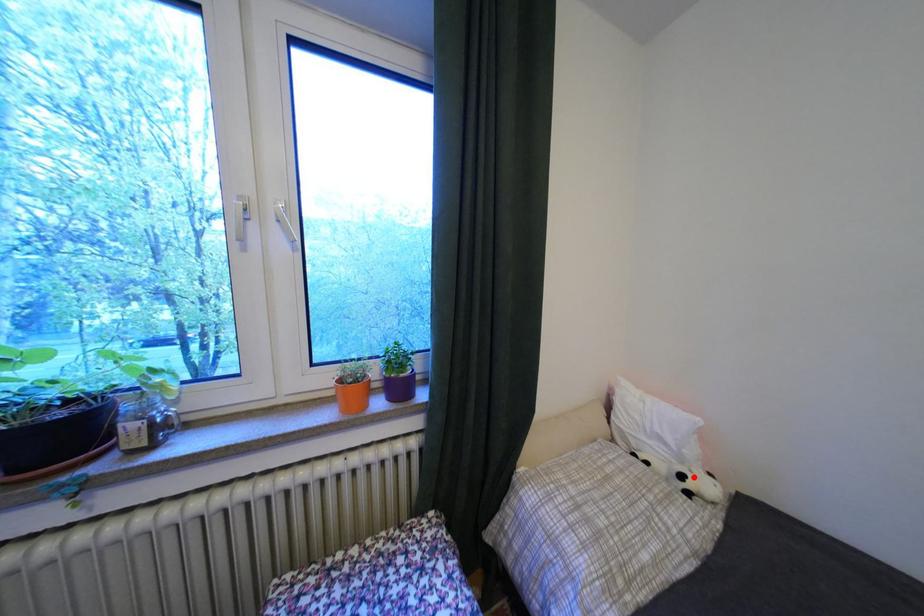
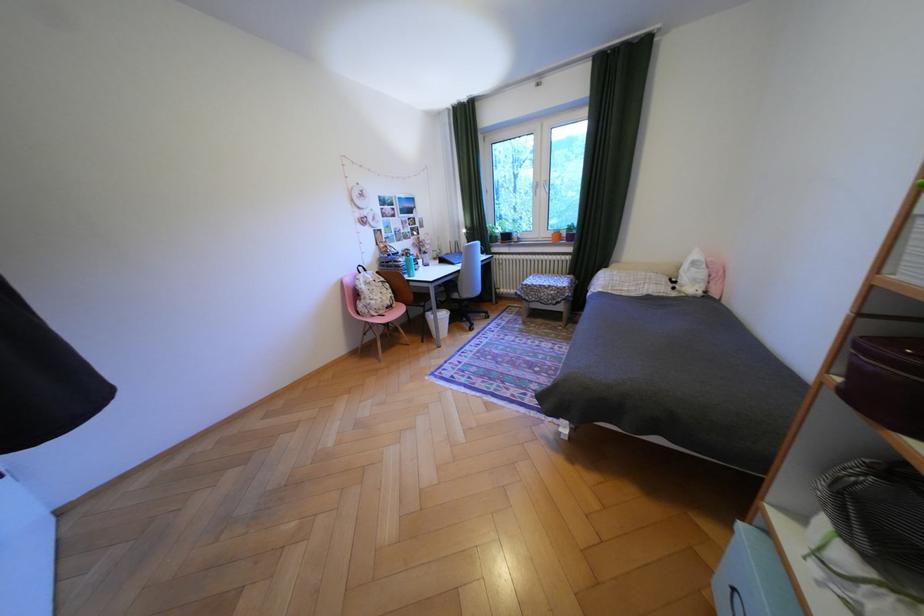
Locate, in the second image, the point that corresponds to the highlighted location in the first image.

(687, 282)